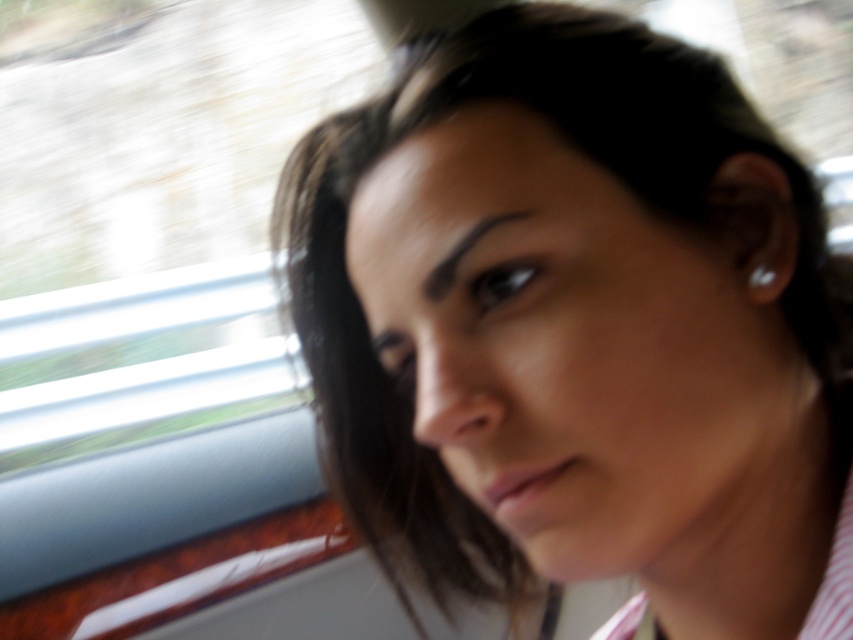
You are a makeup artist analyzing a photo of a person wearing a striped shirt. You notice two items on their face and ear. The items are the black matte eyeliner at center and the white pearl earring at ear. Based on the photo, which item is positioned lower?

The black matte eyeliner at center is positioned lower than the white pearl earring at ear.

You are a photographer trying to capture a clear portrait of the subject. Given that the black matte eyeliner at center is currently 12.15 inches away from the camera, would adjusting the focus to 12 inches help achieve a sharp image of the eyeliner?

The black matte eyeliner at center is 12.15 inches from the camera. Adjusting the focus to 12 inches would be slightly off, so the eyeliner might not be perfectly sharp. To ensure clarity, the focus should be set precisely at 12.15 inches.

You are a photographer trying to capture a clear shot of the subject in the vehicle. Since the smooth skin face at center and the white pearl earring at ear are both in view, which one should you adjust your camera focus on to ensure the earring is sharp?

The smooth skin face at center is to the left of white pearl earring at ear. To ensure the earring is sharp, focus on the white pearl earring at ear since it is positioned further to the right and might be in a different focal plane due to the face being closer to the lens.